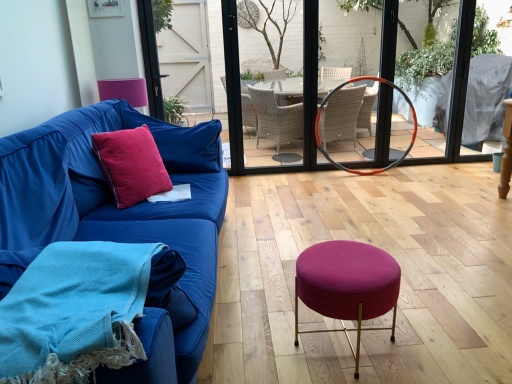
Locate an element on the screen. This screenshot has width=512, height=384. clear glass door at center is located at coordinates (272, 86).

What do you see at coordinates (124, 90) in the screenshot?
I see `pink velvet armchair at upper left` at bounding box center [124, 90].

What is the approximate width of velvet magenta stool at center?

It is 16.78 inches.

What do you see at coordinates (118, 218) in the screenshot? Image resolution: width=512 pixels, height=384 pixels. I see `blue fabric couch at left` at bounding box center [118, 218].

This screenshot has height=384, width=512. What do you see at coordinates (74, 312) in the screenshot? I see `woolen blue blanket at lower left` at bounding box center [74, 312].

In order to face woolen blue blanket at lower left, should I rotate leftwards or rightwards?

You should rotate left by 21.047 degrees.

Find the location of a particular element. This screenshot has height=384, width=512. clear glass door at center is located at coordinates (272, 86).

Is pink velvet armchair at upper left positioned in front of clear glass door at center?

Yes, pink velvet armchair at upper left is in front of clear glass door at center.

Between pink velvet armchair at upper left and clear glass door at center, which one has less height?

With less height is pink velvet armchair at upper left.

This screenshot has height=384, width=512. Find the location of `glass door located underneath the pink velvet armchair at upper left (from a real-world perspective)`. glass door located underneath the pink velvet armchair at upper left (from a real-world perspective) is located at coordinates (272, 86).

Is pink velvet armchair at upper left not close to clear glass door at center?

pink velvet armchair at upper left is far away from clear glass door at center.

From the picture: Based on their sizes in the image, would you say pink velvet armchair at upper left is bigger or smaller than blue fabric couch at left?

pink velvet armchair at upper left is smaller than blue fabric couch at left.

From the image's perspective, which one is positioned higher, pink velvet armchair at upper left or blue fabric couch at left?

From the image's view, pink velvet armchair at upper left is above.

From a real-world perspective, which is physically below, pink velvet armchair at upper left or blue fabric couch at left?

From a 3D spatial view, blue fabric couch at left is below.

What's the angular difference between pink velvet armchair at upper left and blue fabric couch at left's facing directions?

The angle between the facing direction of pink velvet armchair at upper left and the facing direction of blue fabric couch at left is 5.57 degrees.

Is velvet cushion at left closer to camera compared to clear glass door at center?

Yes, it is.

Consider the image. Is velvet cushion at left far from clear glass door at center?

velvet cushion at left is positioned a significant distance from clear glass door at center.

Is velvet cushion at left completely or partially outside of clear glass door at center?

Yes, velvet cushion at left is not within clear glass door at center.

Considering the sizes of velvet cushion at left and clear glass door at center in the image, is velvet cushion at left wider or thinner than clear glass door at center?

In the image, velvet cushion at left appears to be wider than clear glass door at center.

Does point (248, 151) appear closer or farther from the camera than point (353, 82)?

Point (248, 151).

Identify the location of glass door above the orange rubber hula hoop at center (from a real-world perspective). point(272,86).

How different are the orientations of clear glass door at center and orange rubber hula hoop at center in degrees?

There is a 5.27-degree angle between the facing directions of clear glass door at center and orange rubber hula hoop at center.

Can you confirm if clear glass door at center is shorter than orange rubber hula hoop at center?

In fact, clear glass door at center may be taller than orange rubber hula hoop at center.

From the picture: From a real-world perspective, which object stands above the other?

pink velvet armchair at upper left is physically above.

Which of these two, woolen blue blanket at lower left or pink velvet armchair at upper left, stands taller?

pink velvet armchair at upper left is taller.

From the image's perspective, is woolen blue blanket at lower left positioned above or below pink velvet armchair at upper left?

woolen blue blanket at lower left is below pink velvet armchair at upper left.

Based on the photo, between woolen blue blanket at lower left and pink velvet armchair at upper left, which one is positioned in front?

woolen blue blanket at lower left is in front.

Considering the relative sizes of pink velvet pillow at left and orange rubber hula hoop at center in the image provided, is pink velvet pillow at left bigger than orange rubber hula hoop at center?

Incorrect, pink velvet pillow at left is not larger than orange rubber hula hoop at center.

Which is more to the left, pink velvet pillow at left or orange rubber hula hoop at center?

pink velvet pillow at left is more to the left.

Is pink velvet pillow at left positioned beyond the bounds of orange rubber hula hoop at center?

Yes, pink velvet pillow at left is not within orange rubber hula hoop at center.

Is pink velvet pillow at left turned away from orange rubber hula hoop at center?

No, pink velvet pillow at left is not facing the opposite direction of orange rubber hula hoop at center.

Is point (212, 134) less distant than point (139, 84)?

That is True.

Measure the distance between pink velvet pillow at left and pink velvet armchair at upper left.

pink velvet pillow at left is 32.99 inches away from pink velvet armchair at upper left.

Can we say pink velvet pillow at left lies outside pink velvet armchair at upper left?

Yes.

Is pink velvet pillow at left bigger than pink velvet armchair at upper left?

Correct, pink velvet pillow at left is larger in size than pink velvet armchair at upper left.

The width and height of the screenshot is (512, 384). I want to click on armchair that is below the clear glass door at center (from the image's perspective), so click(124, 90).

Find the location of `studio couch located on the right of pink velvet armchair at upper left`. studio couch located on the right of pink velvet armchair at upper left is located at coordinates (x=118, y=218).

Estimate the real-world distances between objects in this image. Which object is further from pink velvet armchair at upper left, woolen blue blanket at lower left or velvet cushion at left?

woolen blue blanket at lower left is further to pink velvet armchair at upper left.

Based on their spatial positions, is velvet magenta stool at center or orange rubber hula hoop at center closer to blue fabric couch at left?

Among the two, velvet magenta stool at center is located nearer to blue fabric couch at left.

Which object lies nearer to the anchor point blue fabric couch at left, velvet magenta stool at center or clear glass door at center?

Among the two, velvet magenta stool at center is located nearer to blue fabric couch at left.

Looking at the image, which one is located further to woolen blue blanket at lower left, velvet magenta stool at center or blue fabric couch at left?

velvet magenta stool at center is positioned further to the anchor woolen blue blanket at lower left.

Estimate the real-world distances between objects in this image. Which object is further from velvet magenta stool at center, woolen blue blanket at lower left or orange rubber hula hoop at center?

The object further to velvet magenta stool at center is orange rubber hula hoop at center.

Looking at the image, which one is located closer to blue fabric couch at left, velvet magenta stool at center or pink velvet armchair at upper left?

velvet magenta stool at center lies closer to blue fabric couch at left than the other object.

Looking at this image, estimate the real-world distances between objects in this image. Which object is further from velvet cushion at left, velvet magenta stool at center or pink velvet pillow at left?

The object further to velvet cushion at left is velvet magenta stool at center.

Estimate the real-world distances between objects in this image. Which object is closer to blue fabric couch at left, pink velvet armchair at upper left or velvet cushion at left?

velvet cushion at left is positioned closer to the anchor blue fabric couch at left.

Locate an element on the screen. pillow between blue fabric couch at left and orange rubber hula hoop at center along the z-axis is located at coordinates (180, 142).

The width and height of the screenshot is (512, 384). I want to click on glass door between blue fabric couch at left and orange rubber hula hoop at center in the front-back direction, so click(272, 86).

At what (x,y) coordinates should I click in order to perform the action: click on bar stool located between blue fabric couch at left and pink velvet armchair at upper left in the depth direction. Please return your answer as a coordinate pair (x, y). The width and height of the screenshot is (512, 384). Looking at the image, I should click on [x=347, y=286].

At what (x,y) coordinates should I click in order to perform the action: click on bar stool between woolen blue blanket at lower left and pink velvet pillow at left in the front-back direction. Please return your answer as a coordinate pair (x, y). This screenshot has width=512, height=384. Looking at the image, I should click on tap(347, 286).